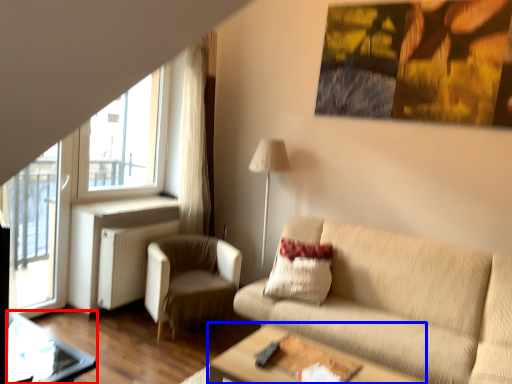
Question: Among these objects, which one is nearest to the camera, glass table (highlighted by a red box) or table (highlighted by a blue box)?

Choices:
 (A) glass table
 (B) table

Answer: (A)